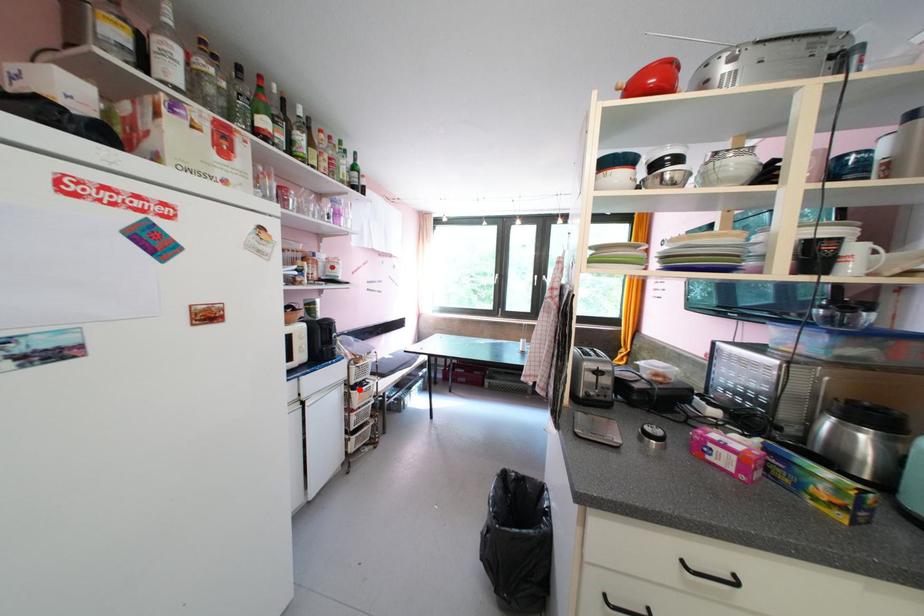
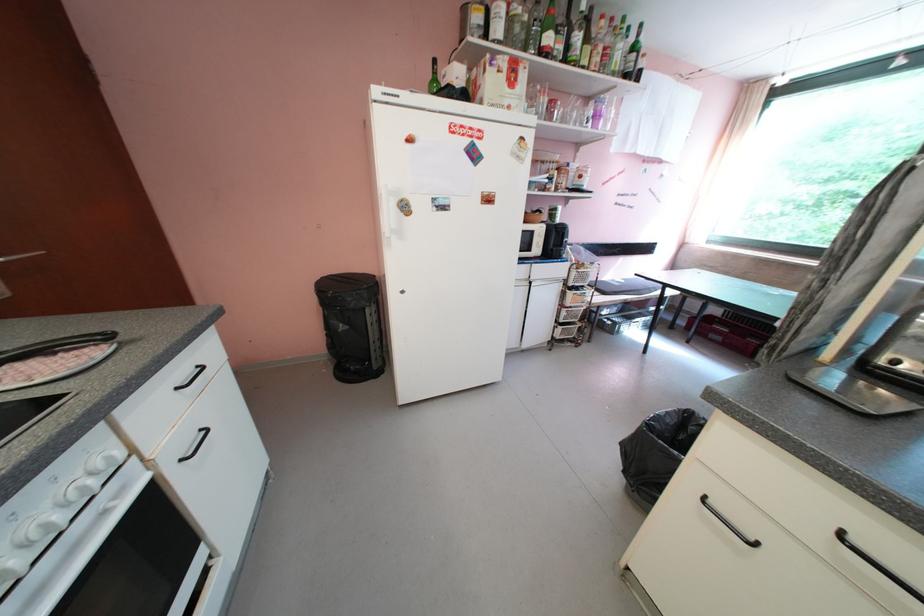
In the second image, find the point that corresponds to the highlighted location in the first image.

(576, 290)